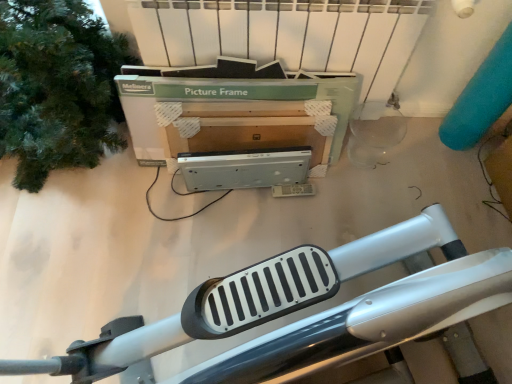
Question: Considering the relative positions of green matte tree at left and silver metallic exercise machine at lower center in the image provided, is green matte tree at left behind silver metallic exercise machine at lower center?

Choices:
 (A) yes
 (B) no

Answer: (B)

Question: Is green matte tree at left facing towards silver metallic exercise machine at lower center?

Choices:
 (A) no
 (B) yes

Answer: (A)

Question: From the image's perspective, does green matte tree at left appear lower than silver metallic exercise machine at lower center?

Choices:
 (A) yes
 (B) no

Answer: (B)

Question: Is green matte tree at left with silver metallic exercise machine at lower center?

Choices:
 (A) no
 (B) yes

Answer: (A)

Question: Can you confirm if green matte tree at left is thinner than silver metallic exercise machine at lower center?

Choices:
 (A) no
 (B) yes

Answer: (B)

Question: From a real-world perspective, is green matte tree at left on top of silver metallic exercise machine at lower center?

Choices:
 (A) no
 (B) yes

Answer: (B)

Question: Is silver metallic exercise machine at lower center facing away from green cardboard picture frame at upper center?

Choices:
 (A) yes
 (B) no

Answer: (A)

Question: Is silver metallic exercise machine at lower center placed right next to green cardboard picture frame at upper center?

Choices:
 (A) yes
 (B) no

Answer: (B)

Question: Does silver metallic exercise machine at lower center lie in front of green cardboard picture frame at upper center?

Choices:
 (A) no
 (B) yes

Answer: (A)

Question: Can you confirm if silver metallic exercise machine at lower center is positioned to the left of green cardboard picture frame at upper center?

Choices:
 (A) no
 (B) yes

Answer: (A)

Question: From a real-world perspective, does silver metallic exercise machine at lower center sit lower than green cardboard picture frame at upper center?

Choices:
 (A) yes
 (B) no

Answer: (A)

Question: Does silver metallic exercise machine at lower center have a greater height compared to green cardboard picture frame at upper center?

Choices:
 (A) no
 (B) yes

Answer: (A)

Question: From the image's perspective, is green cardboard picture frame at upper center under green matte tree at left?

Choices:
 (A) no
 (B) yes

Answer: (B)